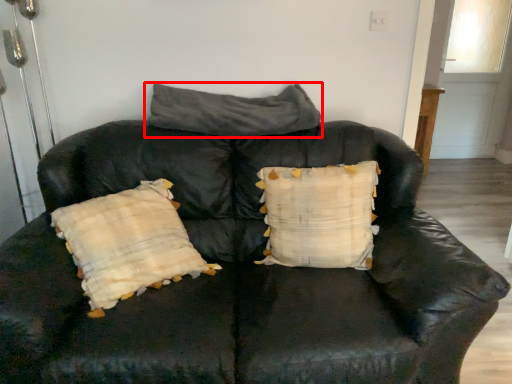
Question: From the image's perspective, where is pillow (annotated by the red box) located relative to pillow?

Choices:
 (A) below
 (B) above

Answer: (B)